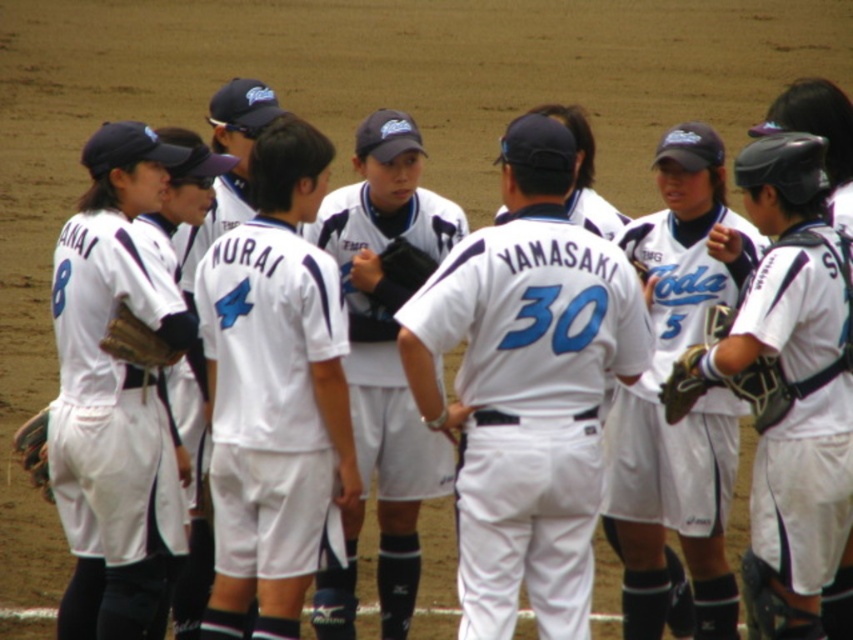
You are a photographer trying to capture a closeup shot of the brown leather glove at lower left without the white matte baseball uniform at center blocking the view. Is it possible to do so given their sizes?

The white matte baseball uniform at center is bigger than the brown leather glove at lower left, so it might block the view. However, since the uniform is at the center and the glove is at the lower left, adjusting the camera angle to focus on the lower left area could allow capturing the glove without obstruction from the larger uniform.

You are a photographer trying to capture a photo of the white matte baseball uniform at center and the brown leather glove at left. From the perspective of someone standing in front of the scene, which object is located to the left?

The brown leather glove at left is located to the left of the white matte baseball uniform at center.

You are a photographer positioned behind the players. You want to take a clear photo of the black leather glove at center without the white matte jersey at center blocking it. What should you do?

The white matte jersey at center is closer to the viewer than the black leather glove at center, so you should move forward to get closer to the black leather glove at center and avoid the obstruction from the white matte jersey at center.